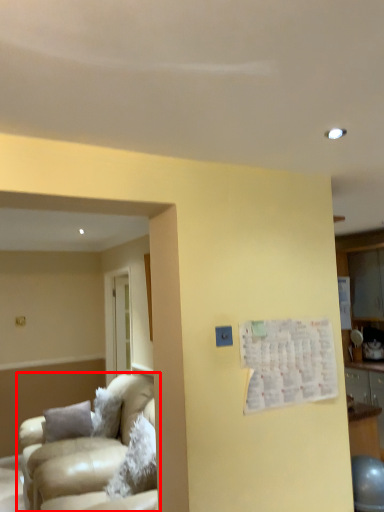
Question: Observing the image, what is the correct spatial positioning of studio couch (annotated by the red box) in reference to bulletin board?

Choices:
 (A) right
 (B) left

Answer: (B)